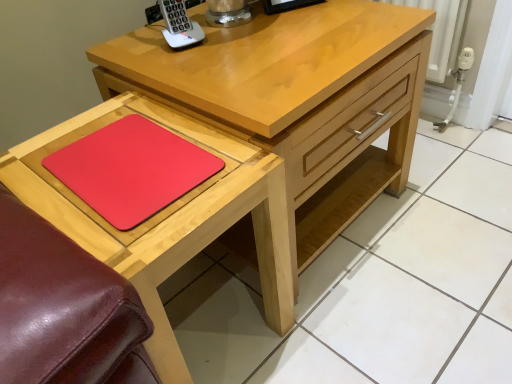
Question: Is rubberized red mousepad at lower left directly adjacent to white plastic phone at upper center?

Choices:
 (A) yes
 (B) no

Answer: (B)

Question: Does rubberized red mousepad at lower left have a lesser height compared to white plastic phone at upper center?

Choices:
 (A) no
 (B) yes

Answer: (B)

Question: Can you confirm if rubberized red mousepad at lower left is positioned to the right of white plastic phone at upper center?

Choices:
 (A) no
 (B) yes

Answer: (A)

Question: From the image's perspective, is rubberized red mousepad at lower left under white plastic phone at upper center?

Choices:
 (A) yes
 (B) no

Answer: (A)

Question: Is rubberized red mousepad at lower left taller than white plastic phone at upper center?

Choices:
 (A) yes
 (B) no

Answer: (B)

Question: Could you tell me if rubberized red mousepad at lower left is facing white plastic phone at upper center?

Choices:
 (A) yes
 (B) no

Answer: (B)

Question: Does matte wood chest of drawers at center have a larger size compared to white plastic phone at upper center?

Choices:
 (A) yes
 (B) no

Answer: (A)

Question: Is white plastic phone at upper center surrounded by matte wood chest of drawers at center?

Choices:
 (A) no
 (B) yes

Answer: (A)

Question: Considering the relative sizes of matte wood chest of drawers at center and white plastic phone at upper center in the image provided, is matte wood chest of drawers at center smaller than white plastic phone at upper center?

Choices:
 (A) no
 (B) yes

Answer: (A)

Question: Can you confirm if matte wood chest of drawers at center is positioned to the right of white plastic phone at upper center?

Choices:
 (A) yes
 (B) no

Answer: (A)

Question: Is matte wood chest of drawers at center closer to the viewer compared to white plastic phone at upper center?

Choices:
 (A) no
 (B) yes

Answer: (B)

Question: From a real-world perspective, is matte wood chest of drawers at center positioned over white plastic phone at upper center based on gravity?

Choices:
 (A) yes
 (B) no

Answer: (B)

Question: From a real-world perspective, is matte wooden table at lower left located higher than white plastic phone at upper center?

Choices:
 (A) yes
 (B) no

Answer: (B)